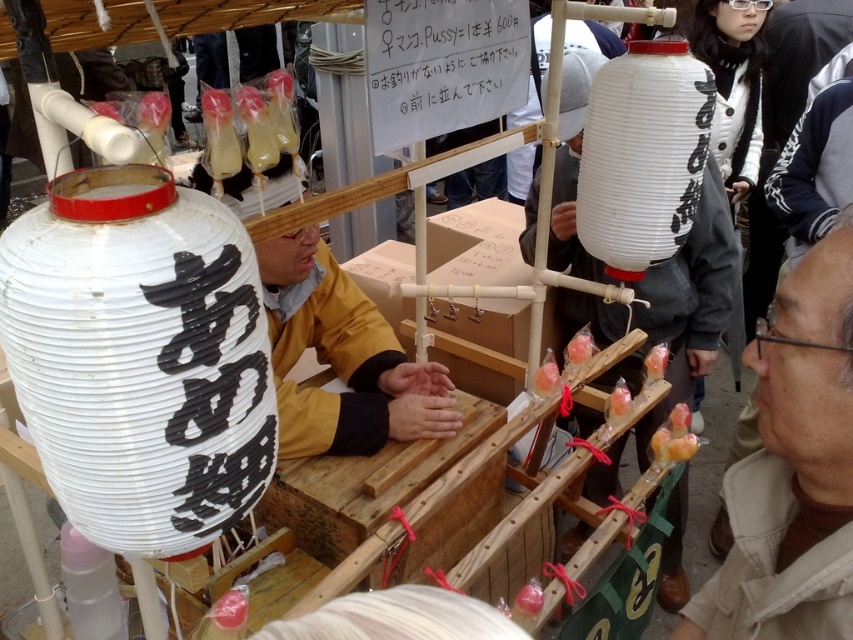
Question: Which point appears closest to the camera in this image?

Choices:
 (A) (486, 67)
 (B) (57, 348)
 (C) (604, 250)
 (D) (815, 573)

Answer: (B)

Question: Which point is farther to the camera?

Choices:
 (A) brown fabric jacket at lower right
 (B) white paper sign at upper center
 (C) white paper lantern at upper center
 (D) white paper lantern at left

Answer: (C)

Question: Is white paper lantern at left positioned in front of brown fabric jacket at lower right?

Choices:
 (A) yes
 (B) no

Answer: (A)

Question: In this image, where is brown fabric jacket at lower right located relative to white paper lantern at upper center?

Choices:
 (A) below
 (B) above

Answer: (A)

Question: Considering the real-world distances, which object is farthest from the white paper lantern at upper center?

Choices:
 (A) white paper lantern at left
 (B) brown fabric jacket at lower right

Answer: (A)

Question: Is white paper lantern at left smaller than white paper sign at upper center?

Choices:
 (A) yes
 (B) no

Answer: (A)